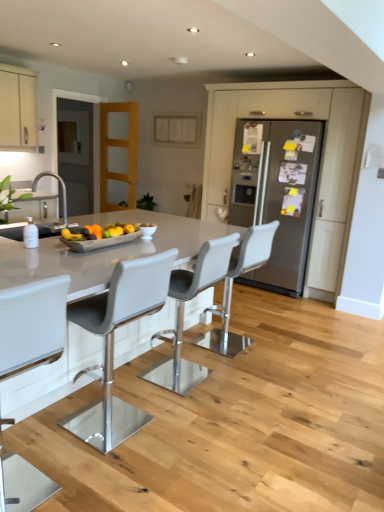
The width and height of the screenshot is (384, 512). What are the coordinates of `free space in front of white leather bar stool at center, the first chair viewed from the back` in the screenshot? It's located at (237, 370).